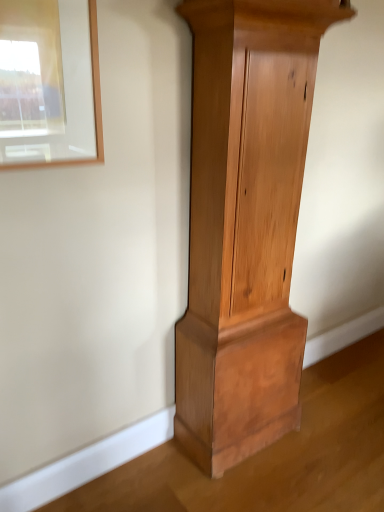
This screenshot has height=512, width=384. What do you see at coordinates (245, 223) in the screenshot? I see `natural wood cupboard at center` at bounding box center [245, 223].

Find the location of a particular element. natural wood cupboard at center is located at coordinates coord(245,223).

At what (x,y) coordinates should I click in order to perform the action: click on natural wood cupboard at center. Please return your answer as a coordinate pair (x, y). The width and height of the screenshot is (384, 512). Looking at the image, I should click on (245, 223).